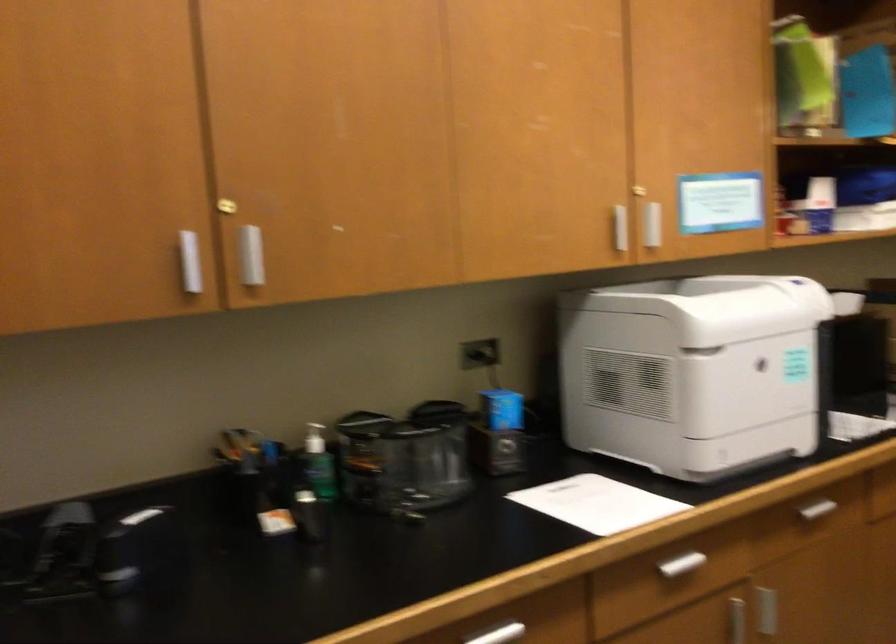
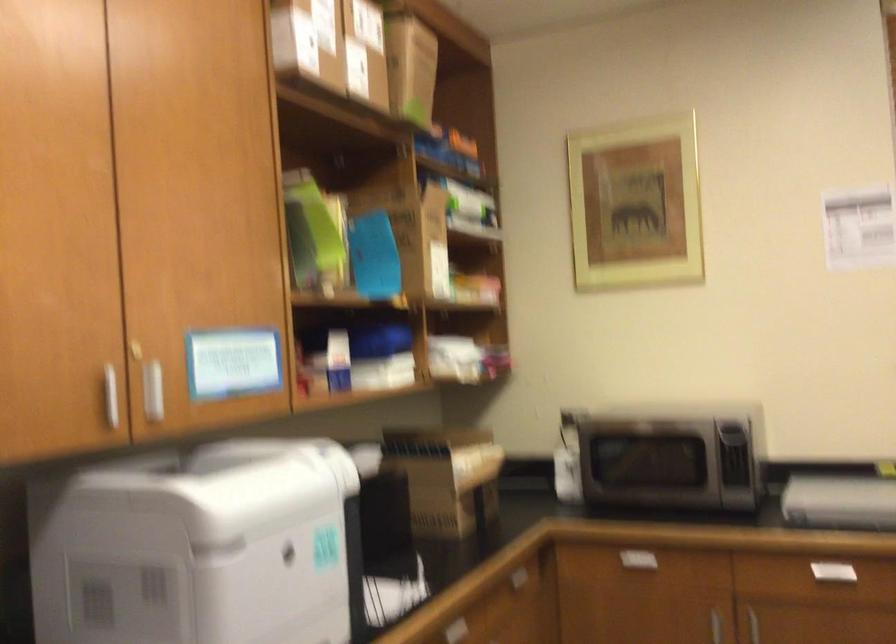
Find the pixel in the second image that matches point 615,230 in the first image.

(110, 395)